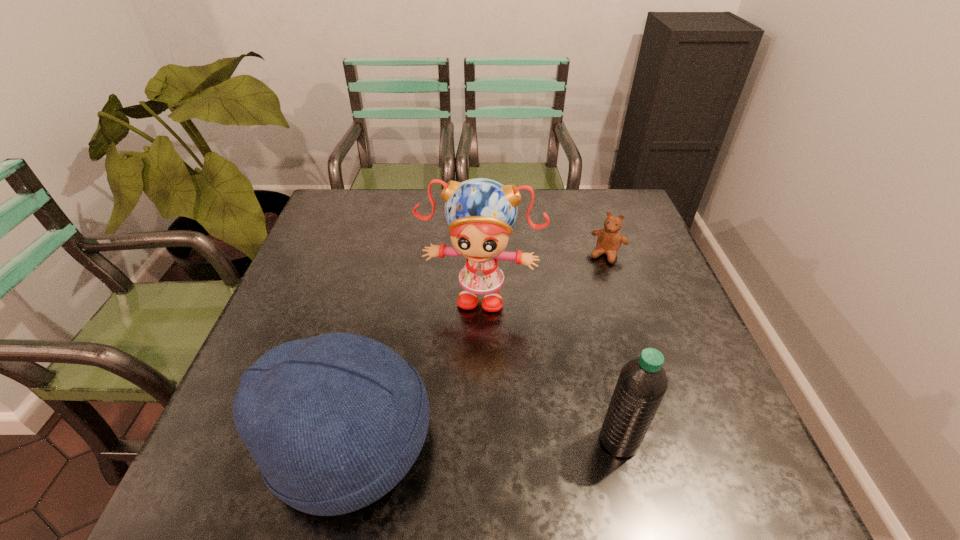
The width and height of the screenshot is (960, 540). I want to click on vacant region located 0.370m on the face of the rightmost object, so click(x=556, y=361).

You are a GUI agent. You are given a task and a screenshot of the screen. Output one action in this format:
    pyautogui.click(x=<x>, y=<y>)
    Task: Click on the free space located on the face of the doll
    The width and height of the screenshot is (960, 540).
    Given the screenshot: What is the action you would take?
    pyautogui.click(x=468, y=332)

You are a GUI agent. You are given a task and a screenshot of the screen. Output one action in this format:
    pyautogui.click(x=<x>, y=<y>)
    Task: Click on the vacant point located 0.090m on the face of the doll
    The image size is (960, 540).
    Given the screenshot: What is the action you would take?
    pyautogui.click(x=466, y=346)

Where is `vacant area situated on the face of the doll`? The image size is (960, 540). vacant area situated on the face of the doll is located at coordinates (446, 441).

Where is `skullcap present at the near edge`? skullcap present at the near edge is located at coordinates (334, 422).

You are a GUI agent. You are given a task and a screenshot of the screen. Output one action in this format:
    pyautogui.click(x=<x>, y=<y>)
    Task: Click on the water bottle situated at the near edge
    Image resolution: width=960 pixels, height=540 pixels.
    Given the screenshot: What is the action you would take?
    pyautogui.click(x=642, y=383)

Find the location of a particular element. object at the left edge is located at coordinates (334, 422).

This screenshot has height=540, width=960. What are the coordinates of `object that is positioned at the right edge` in the screenshot? It's located at (609, 240).

Where is `object located in the near left corner section of the desktop`? object located in the near left corner section of the desktop is located at coordinates (334, 422).

Find the location of a particular element. The width and height of the screenshot is (960, 540). free space at the far edge of the desktop is located at coordinates (372, 231).